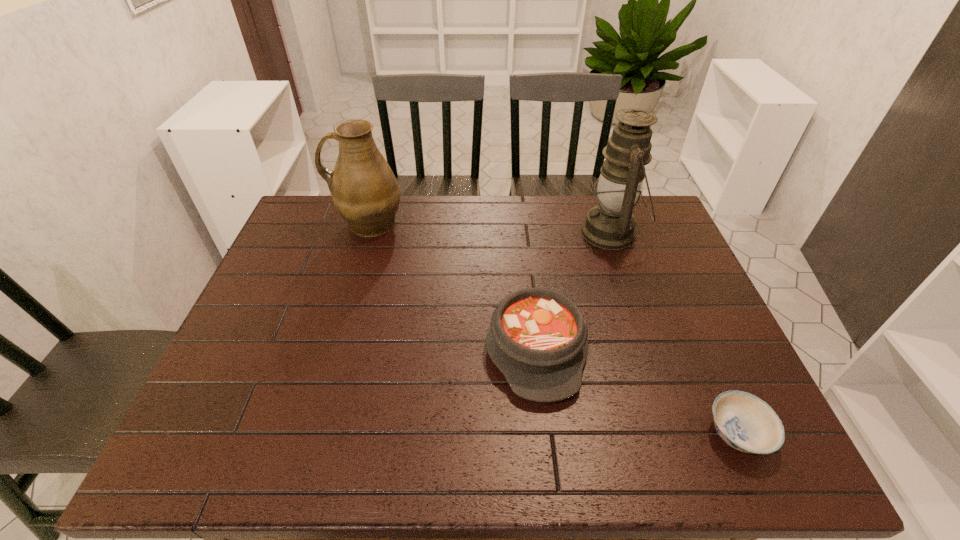
Locate an element on the screen. oil lamp located in the far edge section of the desktop is located at coordinates (611, 225).

You are a GUI agent. You are given a task and a screenshot of the screen. Output one action in this format:
    pyautogui.click(x=<x>, y=<y>)
    Task: Click on the pitcher at the far edge
    
    Given the screenshot: What is the action you would take?
    pyautogui.click(x=365, y=191)

The height and width of the screenshot is (540, 960). I want to click on object that is at the near edge, so click(745, 422).

Image resolution: width=960 pixels, height=540 pixels. I want to click on object that is positioned at the left edge, so click(x=365, y=191).

Image resolution: width=960 pixels, height=540 pixels. I want to click on oil lamp that is positioned at the right edge, so click(x=611, y=225).

Where is `bowl positioned at the right edge`? This screenshot has height=540, width=960. bowl positioned at the right edge is located at coordinates (745, 422).

Where is `object located in the far left corner section of the desktop`? Image resolution: width=960 pixels, height=540 pixels. object located in the far left corner section of the desktop is located at coordinates (365, 191).

At what (x,y) coordinates should I click in order to perform the action: click on object situated at the far right corner. Please return your answer as a coordinate pair (x, y). Looking at the image, I should click on (611, 225).

This screenshot has width=960, height=540. I want to click on object that is at the near right corner, so click(x=745, y=422).

Find the location of a particular element. free space at the far edge of the desktop is located at coordinates (549, 240).